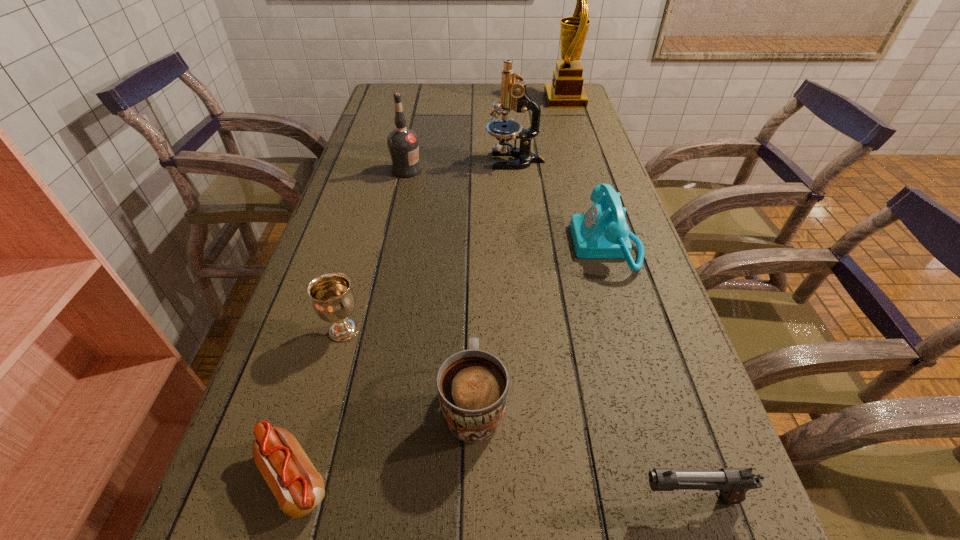
The height and width of the screenshot is (540, 960). What are the coordinates of `vacant space situated on the side of the mug with the handle` in the screenshot? It's located at (475, 267).

Identify the location of blank space located 0.100m on the side of the mug with the handle. (475, 323).

I want to click on free space located on the side of the mug with the handle, so click(x=475, y=284).

Image resolution: width=960 pixels, height=540 pixels. What are the coordinates of `vacant region located in the direction the second shortest object is aimed` in the screenshot? It's located at (472, 498).

Where is `free region located in the direction the second shortest object is aimed`? This screenshot has height=540, width=960. free region located in the direction the second shortest object is aimed is located at coordinates (383, 498).

Find the location of a particular element. vacant area situated in the direction the second shortest object is aimed is located at coordinates (520, 498).

Identify the location of free space located on the right of the shortest object. (448, 478).

This screenshot has width=960, height=540. What are the coordinates of `object present at the far edge` in the screenshot? It's located at pyautogui.click(x=566, y=91).

Locate an element on the screen. vodka that is at the left edge is located at coordinates coord(403,143).

At what (x,y) coordinates should I click in order to perform the action: click on chalice at the left edge. Please return your answer as a coordinate pair (x, y). This screenshot has width=960, height=540. Looking at the image, I should click on (333, 300).